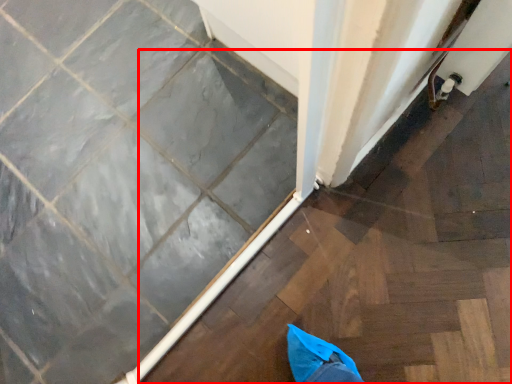
Question: From the image, what is the correct spatial relationship of stairwell (annotated by the red box) in relation to ceramic tile?

Choices:
 (A) left
 (B) right

Answer: (B)